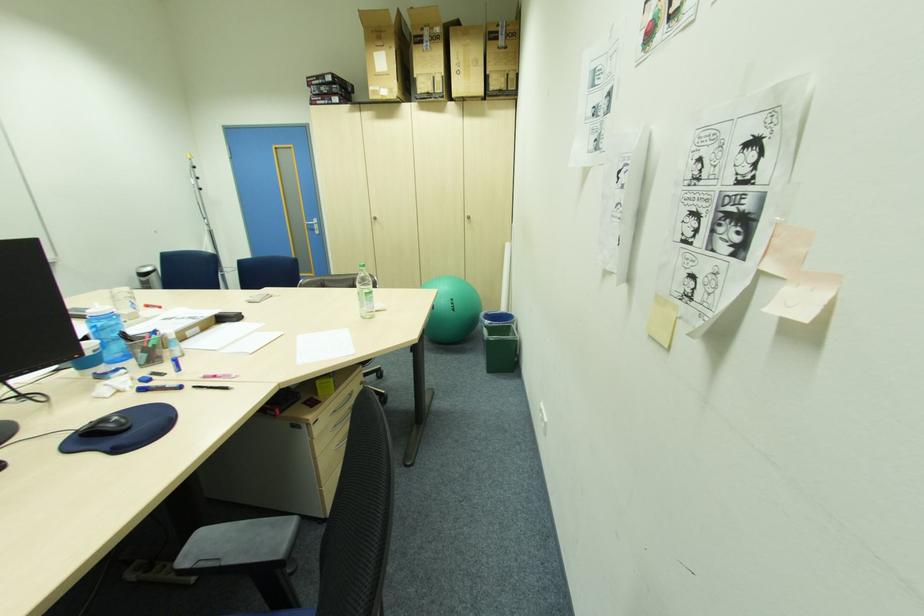
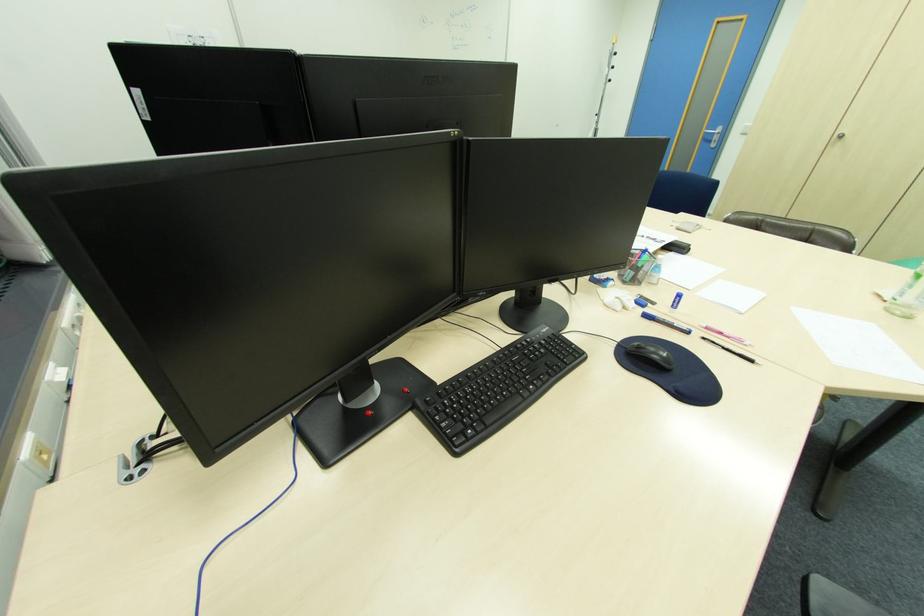
Where in the second image is the point corresponding to pixel 368 317 from the first image?

(894, 310)